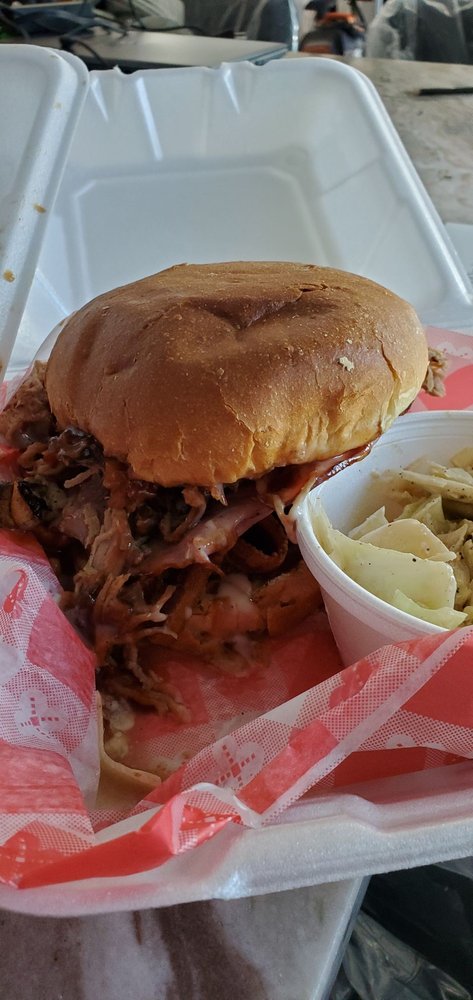
Where is `styrofoam cup`? This screenshot has width=473, height=1000. styrofoam cup is located at coordinates (335, 595).